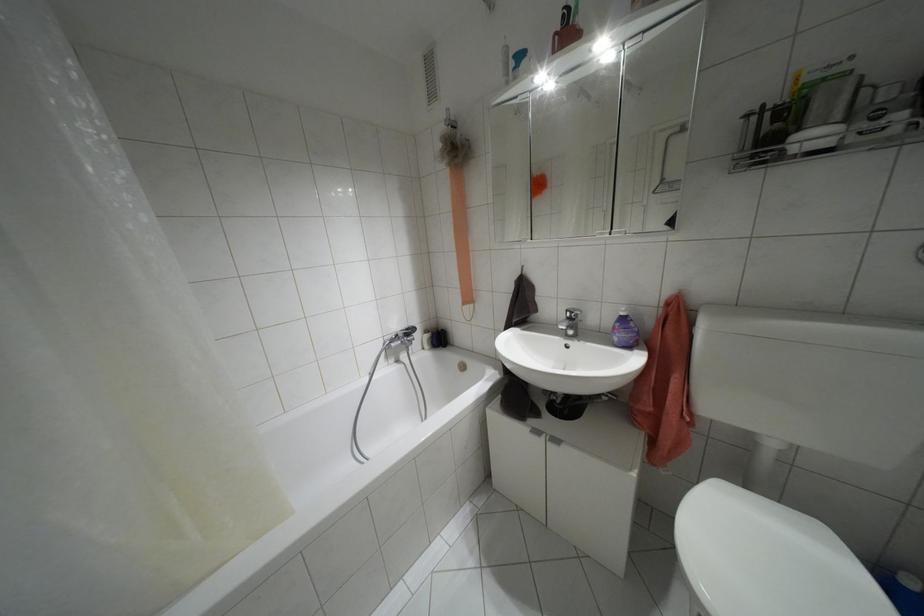
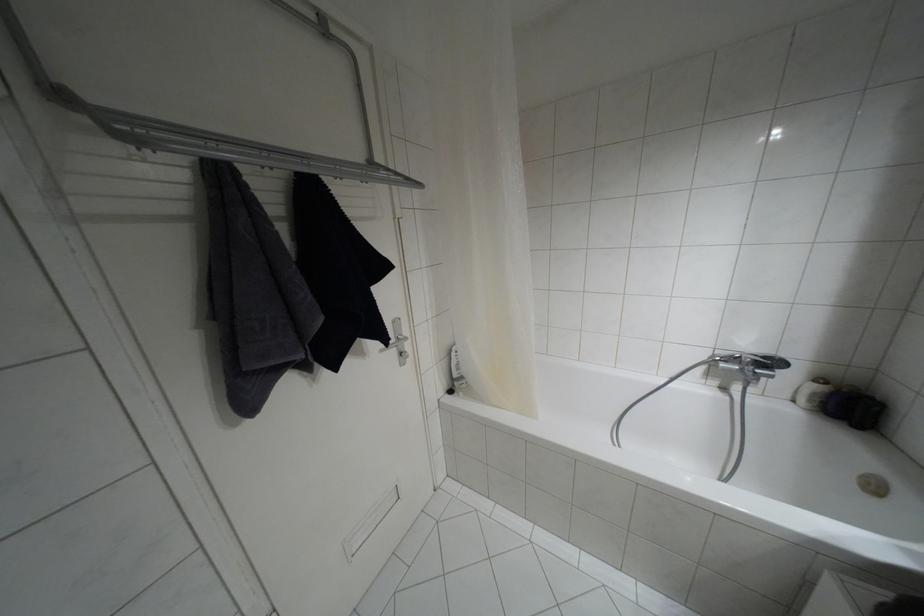
In the second image, find the point that corresponds to pixel 407 329 in the first image.

(763, 357)